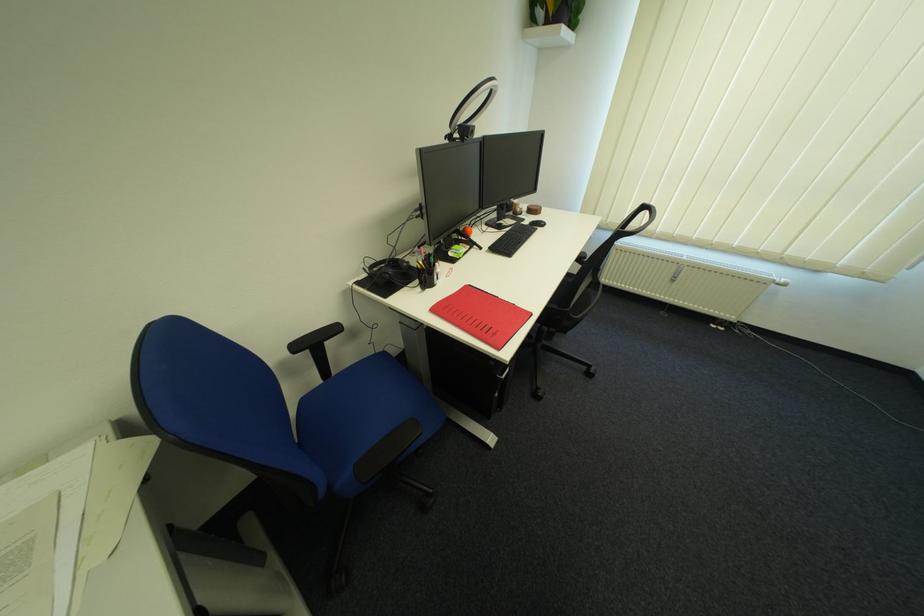
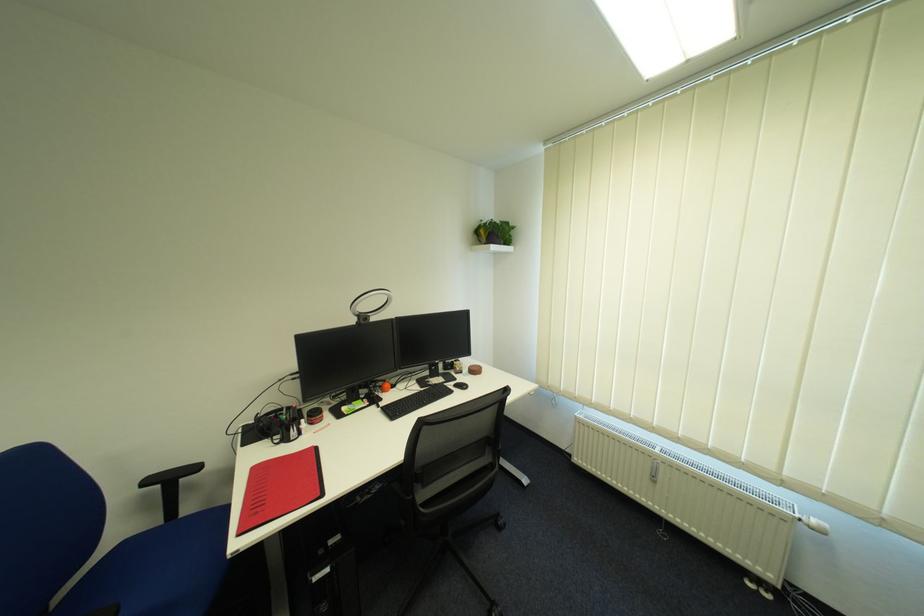
Locate, in the second image, the point that corresponds to [684,282] in the first image.

(664, 483)